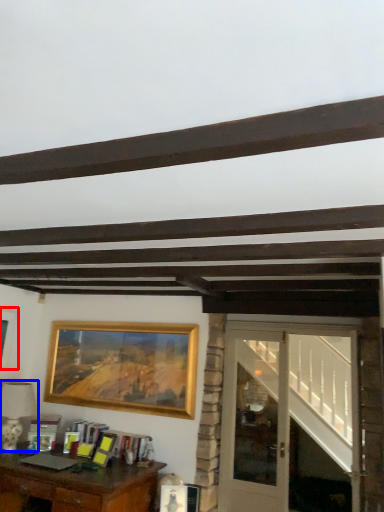
Question: Which object appears closest to the camera in this image, picture frame (highlighted by a red box) or lamp (highlighted by a blue box)?

Choices:
 (A) picture frame
 (B) lamp

Answer: (B)